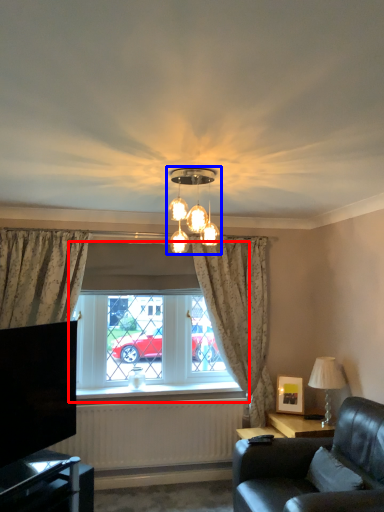
Question: Among these objects, which one is farthest to the camera, window (highlighted by a red box) or lamp (highlighted by a blue box)?

Choices:
 (A) window
 (B) lamp

Answer: (A)